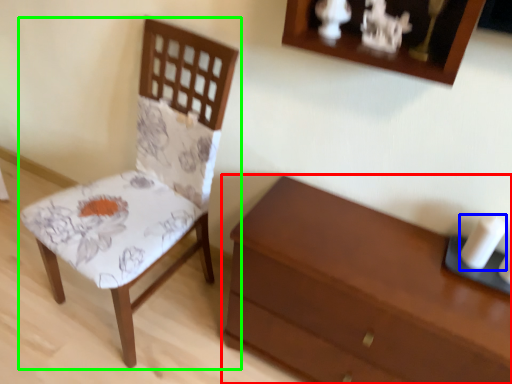
Question: Which is farther away from chest of drawers (highlighted by a red box)? candle (highlighted by a blue box) or chair (highlighted by a green box)?

Choices:
 (A) candle
 (B) chair

Answer: (B)